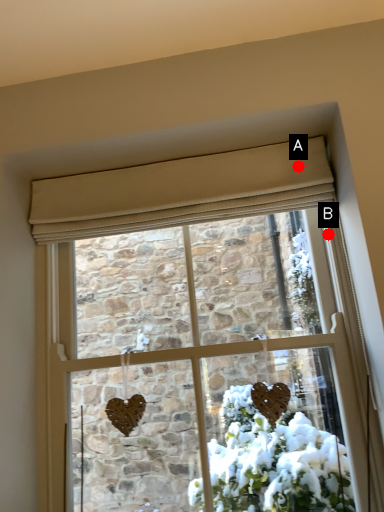
Question: Two points are circled on the image, labeled by A and B beside each circle. Which point is further to the camera?

Choices:
 (A) A is further
 (B) B is further

Answer: (B)